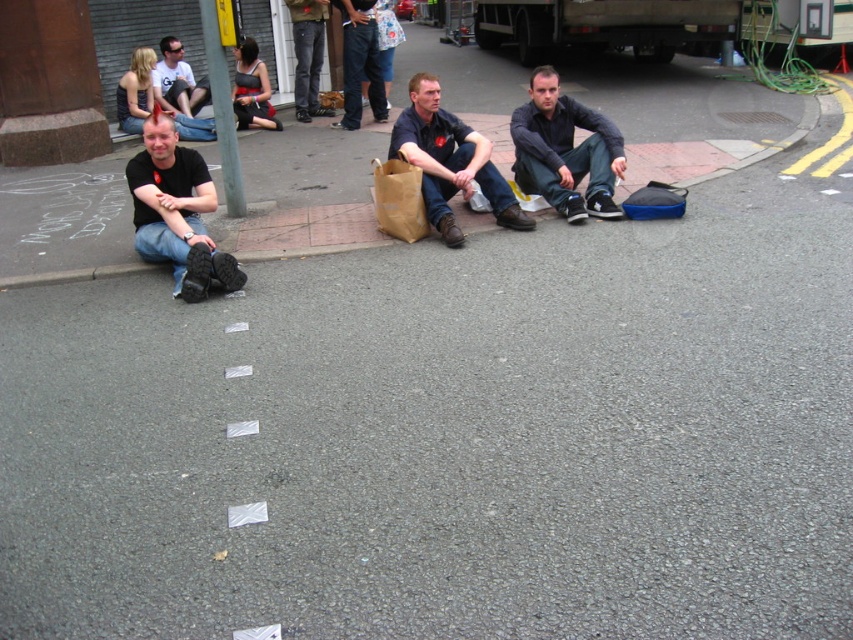
Image resolution: width=853 pixels, height=640 pixels. What do you see at coordinates (398, 198) in the screenshot? I see `brown paper bag at center` at bounding box center [398, 198].

Does brown paper bag at center appear under matte black t-shirt at upper left?

Indeed, brown paper bag at center is positioned under matte black t-shirt at upper left.

Is point (404, 192) more distant than point (171, 52)?

No.

What are the coordinates of `brown paper bag at center` in the screenshot? It's located at (398, 198).

Can you confirm if black matte shirt at left is wider than dark blue jeans at center?

Incorrect, black matte shirt at left's width does not surpass dark blue jeans at center's.

Does black matte shirt at left have a greater height compared to dark blue jeans at center?

Yes.

Where is `black matte shirt at left`? The height and width of the screenshot is (640, 853). black matte shirt at left is located at coordinates (177, 211).

The height and width of the screenshot is (640, 853). Find the location of `black matte shirt at left`. black matte shirt at left is located at coordinates (177, 211).

Which of these two, dark blue jeans at center or dark blue shirt at center, stands taller?

With more height is dark blue shirt at center.

Is dark blue jeans at center smaller than dark blue shirt at center?

Correct, dark blue jeans at center occupies less space than dark blue shirt at center.

Does point (585, 108) come in front of point (531, 218)?

No, (585, 108) is further to viewer.

Locate an element on the screen. This screenshot has height=640, width=853. dark blue jeans at center is located at coordinates (566, 150).